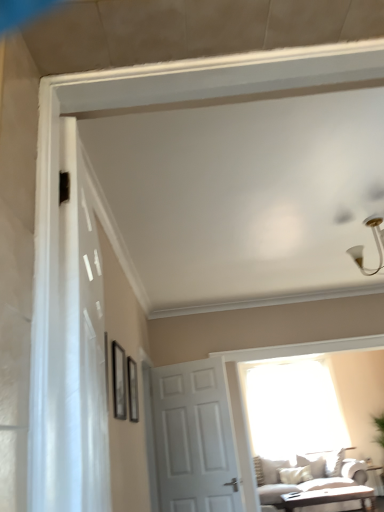
Describe the element at coordinates (376, 479) in the screenshot. I see `white glossy table at lower right, placed as the 2th table when sorted from front to back` at that location.

In order to face white glossy light fixture at upper right, should I rotate leftwards or rightwards?

Rotate right and turn 23.664 degrees.

The image size is (384, 512). I want to click on matte black picture frame at upper center, arranged as the first picture frame when viewed from the back, so coord(133,390).

You are a GUI agent. You are given a task and a screenshot of the screen. Output one action in this format:
    pyautogui.click(x=<x>, y=<y>)
    Task: Click on the light brown wooden coffee table at lower right, the 2th table viewed from the right
    This screenshot has height=512, width=384.
    Given the screenshot: What is the action you would take?
    pyautogui.click(x=329, y=497)

Based on the photo, which object is positioned more to the left, white sheer curtain at left or white glossy table at lower right, which appears as the second table when viewed from the left?

From the viewer's perspective, white sheer curtain at left appears more on the left side.

Considering the relative sizes of white sheer curtain at left and white glossy table at lower right, which is the 1th table in back-to-front order, in the image provided, is white sheer curtain at left wider than white glossy table at lower right, which is the 1th table in back-to-front order,?

No.

How many degrees apart are the facing directions of white sheer curtain at left and white glossy table at lower right, placed as the 2th table when sorted from front to back?

There is a 98.4-degree angle between the facing directions of white sheer curtain at left and white glossy table at lower right, placed as the 2th table when sorted from front to back.

Is white sheer curtain at left not close to white glossy table at lower right, which appears as the second table when viewed from the left?

white sheer curtain at left is positioned a significant distance from white glossy table at lower right, which appears as the second table when viewed from the left.

From the transparent glass window at center, count the 1st picture frame to the left and point to it. Please provide its 2D coordinates.

[(133, 390)]

Which of these two, matte black picture frame at upper center, arranged as the first picture frame when viewed from the back, or transparent glass window at center, stands taller?

transparent glass window at center.

Which point is more forward, (127, 359) or (334, 399)?

Point (127, 359)

Does matte black picture frame at upper center, the 2th picture frame when ordered from front to back, have a larger size compared to transparent glass window at center?

No.

Are white glossy light fixture at upper right and white glossy table at lower right, which is the 1th table in back-to-front order, far apart?

Absolutely, white glossy light fixture at upper right is distant from white glossy table at lower right, which is the 1th table in back-to-front order.

Can you tell me how much white glossy light fixture at upper right and white glossy table at lower right, which is the 1th table in back-to-front order, differ in facing direction?

They differ by 178 degrees in their facing directions.

Is white glossy light fixture at upper right shorter than white glossy table at lower right, placed as the 2th table when sorted from front to back?

Correct, white glossy light fixture at upper right is not as tall as white glossy table at lower right, placed as the 2th table when sorted from front to back.

Considering the points (381, 265) and (375, 487), which point is behind, point (381, 265) or point (375, 487)?

Point (375, 487)

Identify the location of shower curtain in front of the white glossy light fixture at upper right. (67, 337).

Measure the distance between white sheer curtain at left and white glossy light fixture at upper right.

They are 2.80 meters apart.

Between white sheer curtain at left and white glossy light fixture at upper right, which one has smaller width?

white sheer curtain at left.

Image resolution: width=384 pixels, height=512 pixels. I want to click on studio couch lying behind the white glossy light fixture at upper right, so click(314, 480).

Is white glossy light fixture at upper right smaller than beige fabric couch at lower right?

Yes.

Is beige fabric couch at lower right surrounded by white glossy light fixture at upper right?

No.

From a real-world perspective, which is physically below, matte black picture frame at upper center, arranged as the first picture frame when viewed from the back, or light brown wooden coffee table at lower right, the 2th table viewed from the right?

light brown wooden coffee table at lower right, the 2th table viewed from the right.

From the image's perspective, between matte black picture frame at upper center, arranged as the first picture frame when viewed from the back, and light brown wooden coffee table at lower right, which is the second table from back to front, which one is located above?

matte black picture frame at upper center, arranged as the first picture frame when viewed from the back, from the image's perspective.

How many degrees apart are the facing directions of matte black picture frame at upper center, arranged as the first picture frame when viewed from the back, and light brown wooden coffee table at lower right, which is the second table from back to front?

92.6 degrees separate the facing orientations of matte black picture frame at upper center, arranged as the first picture frame when viewed from the back, and light brown wooden coffee table at lower right, which is the second table from back to front.

Can you confirm if matte black picture frame at upper center, arranged as the first picture frame when viewed from the back, is wider than light brown wooden coffee table at lower right, the 1th table when ordered from front to back?

In fact, matte black picture frame at upper center, arranged as the first picture frame when viewed from the back, might be narrower than light brown wooden coffee table at lower right, the 1th table when ordered from front to back.

Which of these two, light brown wooden coffee table at lower right, the 1th table when ordered from front to back, or matte black picture frame at upper left, which appears as the second picture frame when viewed from the back, is bigger?

light brown wooden coffee table at lower right, the 1th table when ordered from front to back, is bigger.

From the image's perspective, which table is the 1st one below the matte black picture frame at upper left, arranged as the 1th picture frame when viewed from the front? Please provide its 2D coordinates.

[(329, 497)]

In the scene shown: Could you measure the distance between light brown wooden coffee table at lower right, which is the second table from back to front, and matte black picture frame at upper left, which appears as the second picture frame when viewed from the back?

light brown wooden coffee table at lower right, which is the second table from back to front, is 4.55 meters away from matte black picture frame at upper left, which appears as the second picture frame when viewed from the back.

Based on the photo, which object is thinner, light brown wooden coffee table at lower right, the 1th table when ordered from left to right, or matte black picture frame at upper left, arranged as the 1th picture frame when viewed from the front?

With smaller width is matte black picture frame at upper left, arranged as the 1th picture frame when viewed from the front.

Locate an element on the screen. shower curtain above the white glossy table at lower right, placed as the 2th table when sorted from front to back (from the image's perspective) is located at coordinates (67, 337).

Where is `window that appears below the matte black picture frame at upper center, the 2th picture frame when ordered from front to back (from a real-world perspective)`? This screenshot has width=384, height=512. window that appears below the matte black picture frame at upper center, the 2th picture frame when ordered from front to back (from a real-world perspective) is located at coordinates (292, 408).

Estimate the real-world distances between objects in this image. Which object is closer to transparent glass window at center, white matte door at center or white glossy light fixture at upper right?

white matte door at center is positioned closer to the anchor transparent glass window at center.

From the image, which object appears to be farther from transparent glass window at center, matte black picture frame at upper center, the 2th picture frame when ordered from front to back, or beige fabric couch at lower right?

matte black picture frame at upper center, the 2th picture frame when ordered from front to back, is positioned further to the anchor transparent glass window at center.

Consider the image. From the image, which object appears to be nearer to transparent glass window at center, beige fabric couch at lower right or matte black picture frame at upper left, which appears as the second picture frame when viewed from the back?

beige fabric couch at lower right.

Considering their positions, is matte black picture frame at upper center, the 2th picture frame when ordered from front to back, positioned closer to beige fabric couch at lower right than white sheer curtain at left?

matte black picture frame at upper center, the 2th picture frame when ordered from front to back, is positioned closer to the anchor beige fabric couch at lower right.

Considering their positions, is matte black picture frame at upper left, which appears as the second picture frame when viewed from the back, positioned further to matte black picture frame at upper center, arranged as the first picture frame when viewed from the back, than white glossy table at lower right, the first table positioned from the right?

white glossy table at lower right, the first table positioned from the right, is further to matte black picture frame at upper center, arranged as the first picture frame when viewed from the back.

Based on their spatial positions, is white glossy light fixture at upper right or light brown wooden coffee table at lower right, the 1th table when ordered from front to back, further from transparent glass window at center?

The object further to transparent glass window at center is white glossy light fixture at upper right.

Looking at the image, which one is located closer to matte black picture frame at upper left, which appears as the second picture frame when viewed from the back, beige fabric couch at lower right or light brown wooden coffee table at lower right, the 1th table when ordered from front to back?

beige fabric couch at lower right is closer to matte black picture frame at upper left, which appears as the second picture frame when viewed from the back.

When comparing their distances from white sheer curtain at left, does matte black picture frame at upper center, arranged as the first picture frame when viewed from the back, or light brown wooden coffee table at lower right, the 1th table when ordered from left to right, seem further?

The object further to white sheer curtain at left is light brown wooden coffee table at lower right, the 1th table when ordered from left to right.

You are a GUI agent. You are given a task and a screenshot of the screen. Output one action in this format:
    pyautogui.click(x=<x>, y=<y>)
    Task: Click on the door located between matte black picture frame at upper left, arranged as the 1th picture frame when viewed from the front, and white glossy table at lower right, which appears as the second table when viewed from the left, in the depth direction
    Image resolution: width=384 pixels, height=512 pixels.
    Given the screenshot: What is the action you would take?
    pyautogui.click(x=191, y=438)

This screenshot has height=512, width=384. Identify the location of studio couch between white sheer curtain at left and white glossy table at lower right, which is the 1th table in back-to-front order, along the z-axis. (314, 480).

This screenshot has height=512, width=384. What are the coordinates of `studio couch between matte black picture frame at upper center, the 2th picture frame when ordered from front to back, and light brown wooden coffee table at lower right, the 1th table when ordered from left to right, from front to back` in the screenshot? It's located at (314, 480).

You are a GUI agent. You are given a task and a screenshot of the screen. Output one action in this format:
    pyautogui.click(x=<x>, y=<y>)
    Task: Click on the door located between matte black picture frame at upper center, arranged as the first picture frame when viewed from the back, and transparent glass window at center in the depth direction
    
    Given the screenshot: What is the action you would take?
    pyautogui.click(x=191, y=438)